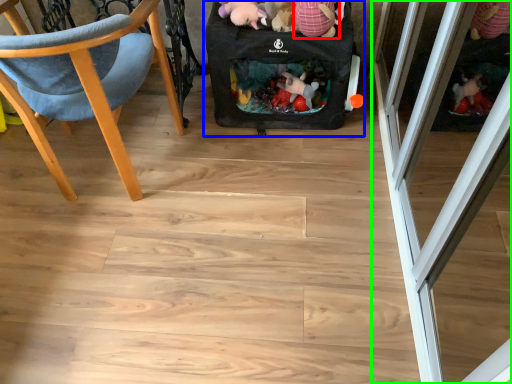
Question: Estimate the real-world distances between objects in this image. Which object is closer to toy (highlighted by a red box), baby carriage (highlighted by a blue box) or screen door (highlighted by a green box)?

Choices:
 (A) baby carriage
 (B) screen door

Answer: (A)